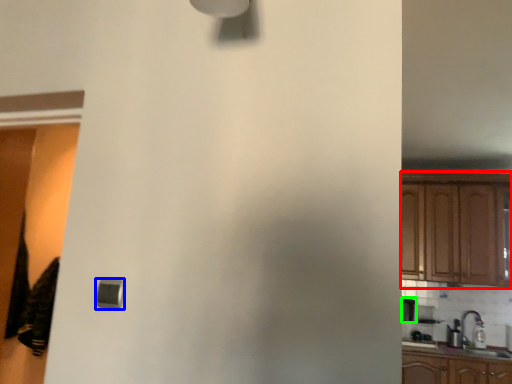
Question: Estimate the real-world distances between objects in this image. Which object is closer to cabinetry (highlighted by a red box), light (highlighted by a blue box) or appliance (highlighted by a green box)?

Choices:
 (A) light
 (B) appliance

Answer: (B)